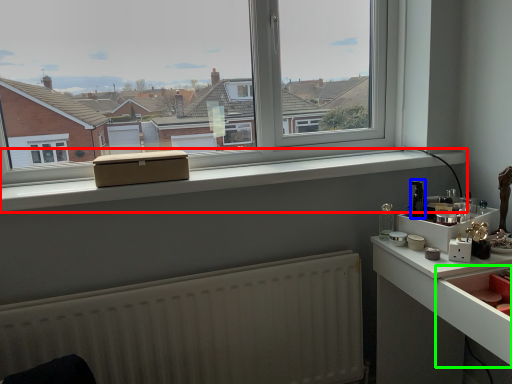
Question: Which is nearer to the window sill (highlighted by a red box)? appliance (highlighted by a blue box) or drawer (highlighted by a green box).

Choices:
 (A) appliance
 (B) drawer

Answer: (A)